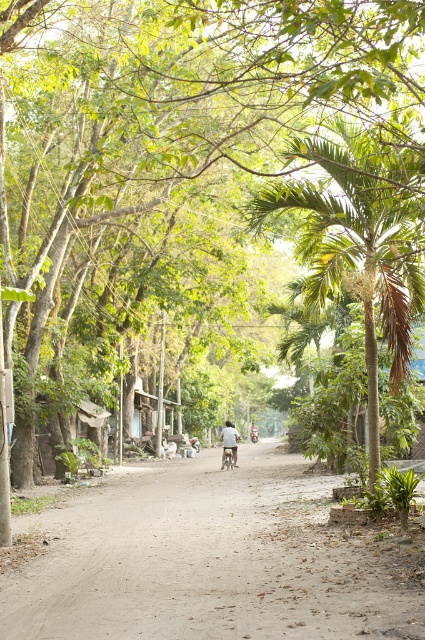
Question: Which point is farther to the camera?

Choices:
 (A) metallic silver bicycle at center
 (B) green leafy palm tree at center

Answer: (A)

Question: Is brown dirt track at center thinner than light brown leather jacket at center?

Choices:
 (A) yes
 (B) no

Answer: (B)

Question: Which point is farther from the camera taking this photo?

Choices:
 (A) (251, 429)
 (B) (294, 582)
 (C) (234, 428)

Answer: (A)

Question: Does brown dirt track at center have a greater width compared to green leafy palm tree at center?

Choices:
 (A) yes
 (B) no

Answer: (A)

Question: Which point is farther to the camera?

Choices:
 (A) brown dirt track at center
 (B) light brown leather jacket at center
 (C) light blue fabric shirt at center
 (D) metallic silver bicycle at center

Answer: (B)

Question: Can you confirm if brown dirt track at center is bigger than metallic silver bicycle at center?

Choices:
 (A) no
 (B) yes

Answer: (B)